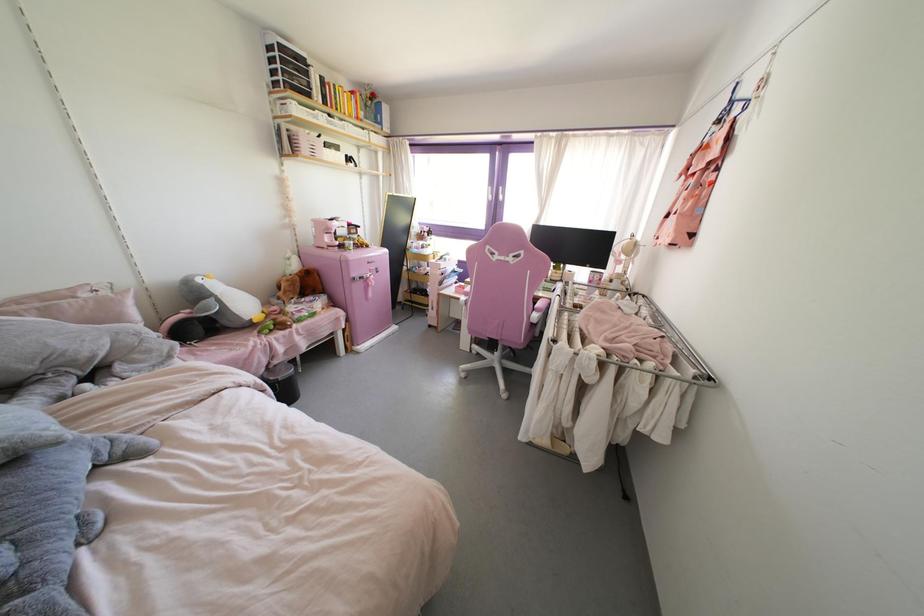
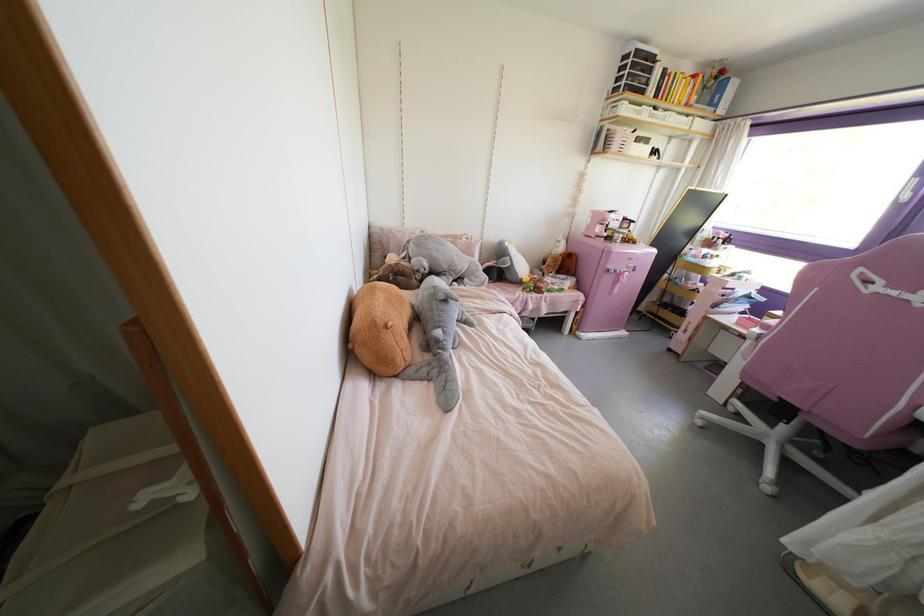
Locate, in the second image, the point that corresponds to pixel 466 294 in the first image.

(764, 326)